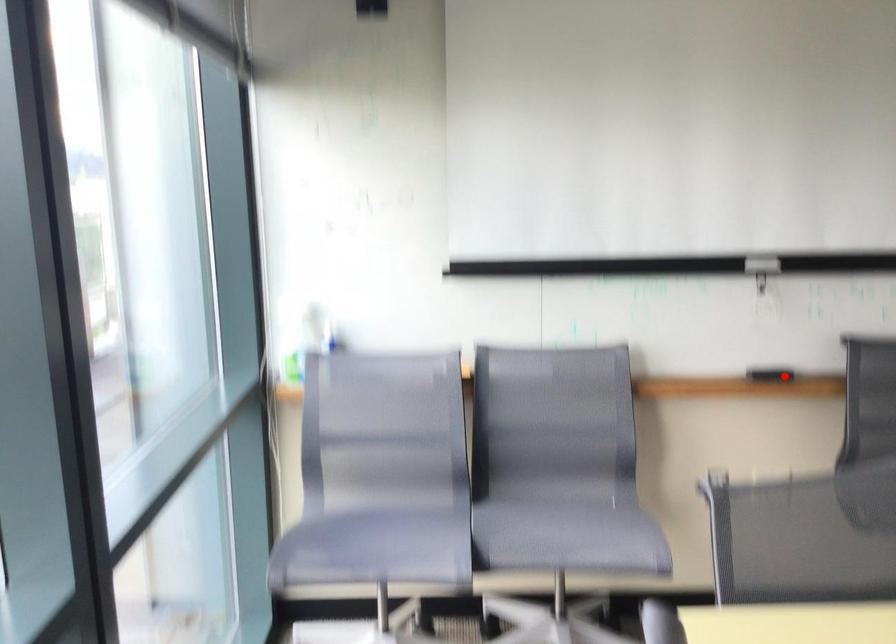
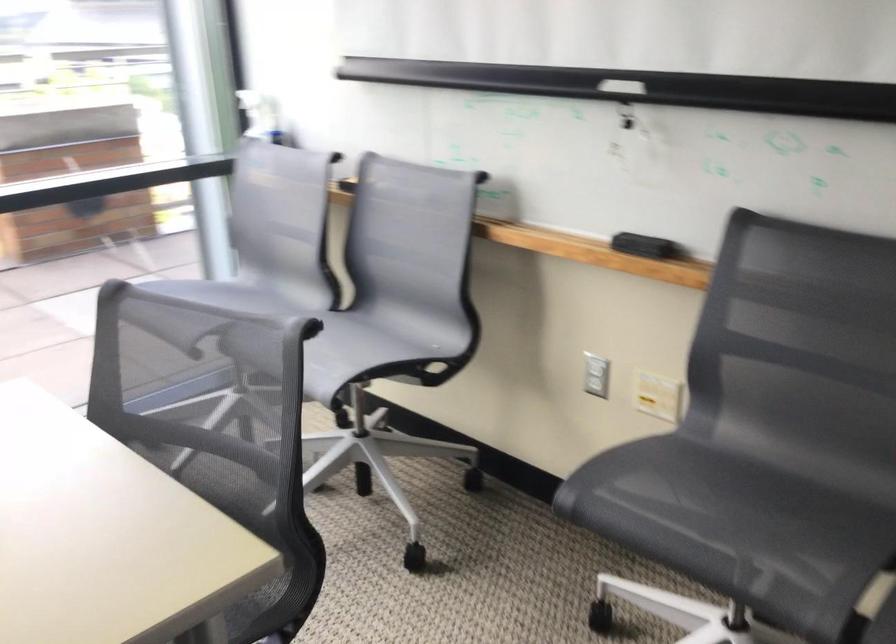
Find the pixel in the second image that matches the highlighted location in the first image.

(643, 245)